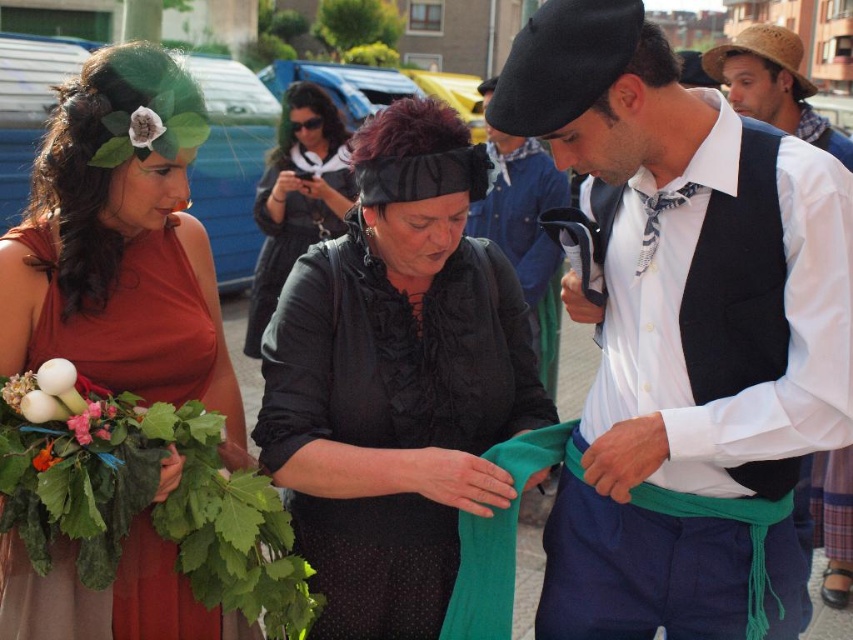
Between rustic straw hat at upper right and green leafy bouquet at lower left, which one is positioned higher?

rustic straw hat at upper right

Describe the element at coordinates (773, 84) in the screenshot. The height and width of the screenshot is (640, 853). I see `rustic straw hat at upper right` at that location.

I want to click on rustic straw hat at upper right, so click(x=773, y=84).

What do you see at coordinates (680, 320) in the screenshot?
I see `matte black vest at center` at bounding box center [680, 320].

Can you confirm if matte black vest at center is shorter than matte black hat at center?

Correct, matte black vest at center is not as tall as matte black hat at center.

Which is behind, point (759, 454) or point (494, 156)?

Positioned behind is point (494, 156).

The width and height of the screenshot is (853, 640). I want to click on matte black vest at center, so click(x=680, y=320).

Does point (195, 376) come behind point (85, 424)?

That is True.

Find the location of `matte red dress at left`. matte red dress at left is located at coordinates (119, 244).